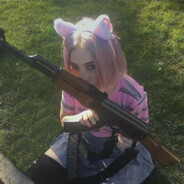
Where is `handle`? The image size is (184, 184). handle is located at coordinates (71, 127).